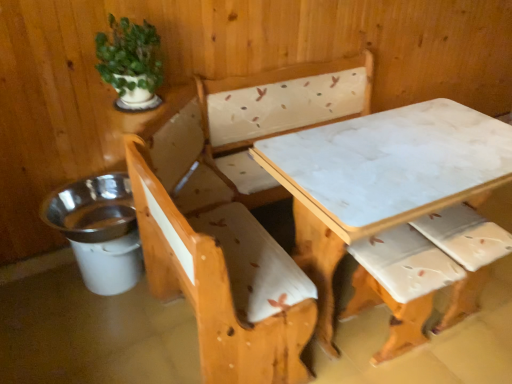
Question: From a real-world perspective, is green matte plant at upper left located higher than white marble table at center?

Choices:
 (A) yes
 (B) no

Answer: (A)

Question: Considering the relative sizes of green matte plant at upper left and white marble table at center in the image provided, is green matte plant at upper left taller than white marble table at center?

Choices:
 (A) no
 (B) yes

Answer: (A)

Question: Does green matte plant at upper left have a larger size compared to white marble table at center?

Choices:
 (A) no
 (B) yes

Answer: (A)

Question: Are green matte plant at upper left and white marble table at center located far from each other?

Choices:
 (A) no
 (B) yes

Answer: (A)

Question: From the image's perspective, would you say green matte plant at upper left is shown under white marble table at center?

Choices:
 (A) no
 (B) yes

Answer: (A)

Question: Is the position of green matte plant at upper left more distant than that of white marble table at center?

Choices:
 (A) no
 (B) yes

Answer: (B)

Question: From a real-world perspective, is white marble table at center on green matte plant at upper left?

Choices:
 (A) yes
 (B) no

Answer: (B)

Question: From a real-world perspective, is white marble table at center beneath green matte plant at upper left?

Choices:
 (A) yes
 (B) no

Answer: (A)

Question: Is white marble table at center oriented away from green matte plant at upper left?

Choices:
 (A) no
 (B) yes

Answer: (A)

Question: Does white marble table at center lie in front of green matte plant at upper left?

Choices:
 (A) yes
 (B) no

Answer: (A)

Question: Is white marble table at center in contact with green matte plant at upper left?

Choices:
 (A) yes
 (B) no

Answer: (B)

Question: Does white marble table at center contain green matte plant at upper left?

Choices:
 (A) yes
 (B) no

Answer: (B)

Question: Would you say green matte plant at upper left is to the left or to the right of white marble table at center in the picture?

Choices:
 (A) left
 (B) right

Answer: (A)